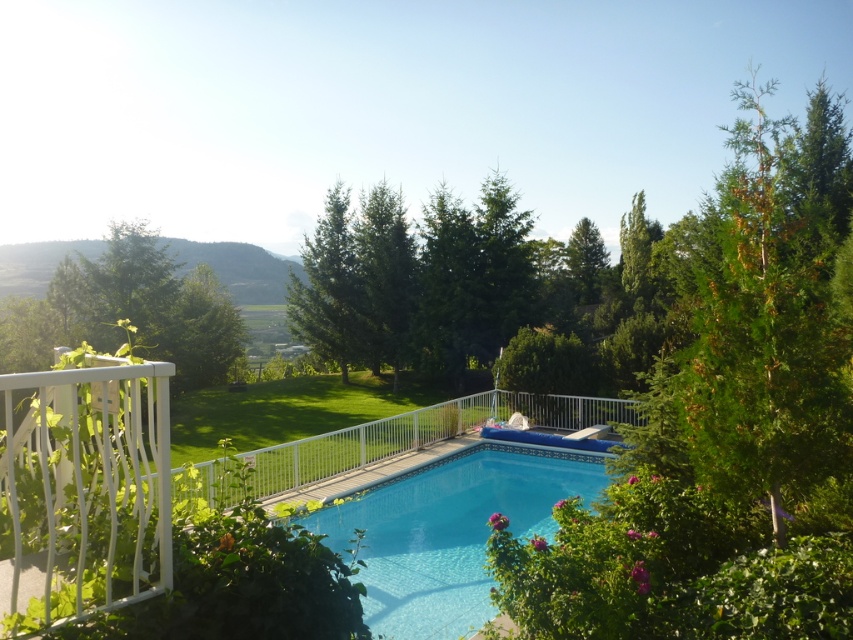
Which is behind, point (782, 352) or point (421, 568)?

Positioned behind is point (421, 568).

Does green leafy tree at upper right appear over clear glass pool at center?

Correct, green leafy tree at upper right is located above clear glass pool at center.

Identify the location of green leafy tree at upper right. The height and width of the screenshot is (640, 853). (759, 314).

Where is `green leafy tree at upper right`? The image size is (853, 640). green leafy tree at upper right is located at coordinates (759, 314).

Which is in front, point (331, 508) or point (213, 378)?

Positioned in front is point (331, 508).

From the picture: Is clear glass pool at center shorter than green leafy tree at left?

Yes.

Is point (514, 497) farther from viewer compared to point (122, 276)?

No, it is in front of (122, 276).

I want to click on clear glass pool at center, so click(x=445, y=524).

From the picture: Does white wrought iron railing at left have a larger size compared to clear glass pool at center?

No, white wrought iron railing at left is not bigger than clear glass pool at center.

Is white wrought iron railing at left smaller than clear glass pool at center?

Yes, white wrought iron railing at left is smaller than clear glass pool at center.

Is point (83, 502) in front of point (413, 621)?

That is True.

The height and width of the screenshot is (640, 853). I want to click on white wrought iron railing at left, so click(82, 490).